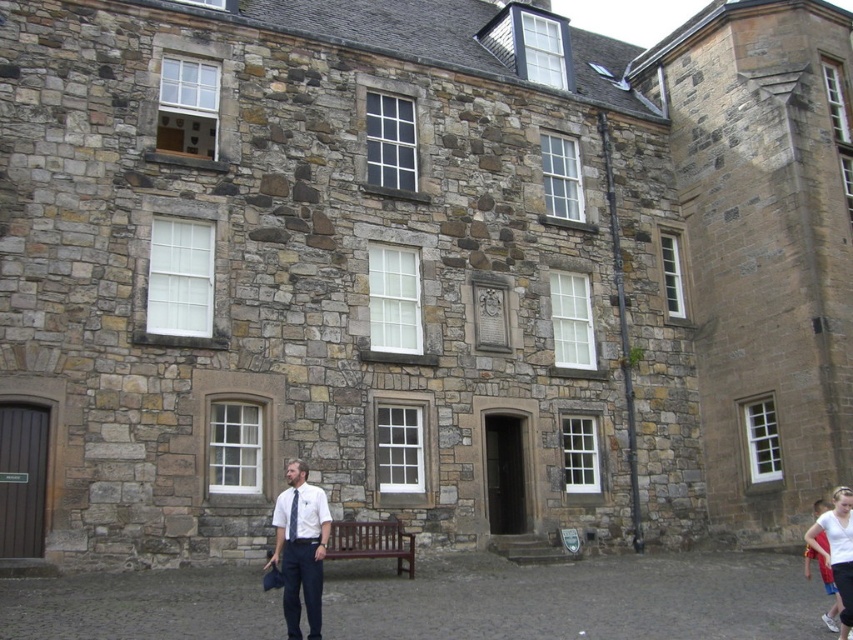
Question: Which of the following is the closest to the observer?

Choices:
 (A) white cotton t-shirt at lower right
 (B) white shirt at center

Answer: (B)

Question: Which is nearer to the blue silk tie at center?

Choices:
 (A) white cotton t-shirt at lower right
 (B) white shirt at center

Answer: (B)

Question: Does white shirt at center come behind white cotton t-shirt at lower right?

Choices:
 (A) yes
 (B) no

Answer: (B)

Question: Can you confirm if white cotton t-shirt at lower right is positioned to the left of blue silk tie at center?

Choices:
 (A) yes
 (B) no

Answer: (B)

Question: Which of the following is the closest to the observer?

Choices:
 (A) (289, 525)
 (B) (846, 604)
 (C) (294, 540)

Answer: (B)

Question: Is the position of white shirt at center less distant than that of white cotton t-shirt at lower right?

Choices:
 (A) yes
 (B) no

Answer: (A)